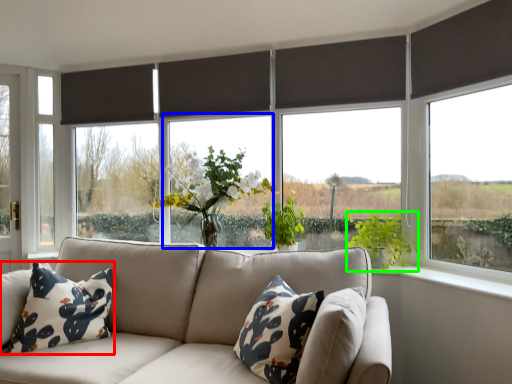
Question: Estimate the real-world distances between objects in this image. Which object is closer to pillow (highlighted by a red box), window (highlighted by a blue box) or vegetation (highlighted by a green box)?

Choices:
 (A) window
 (B) vegetation

Answer: (A)